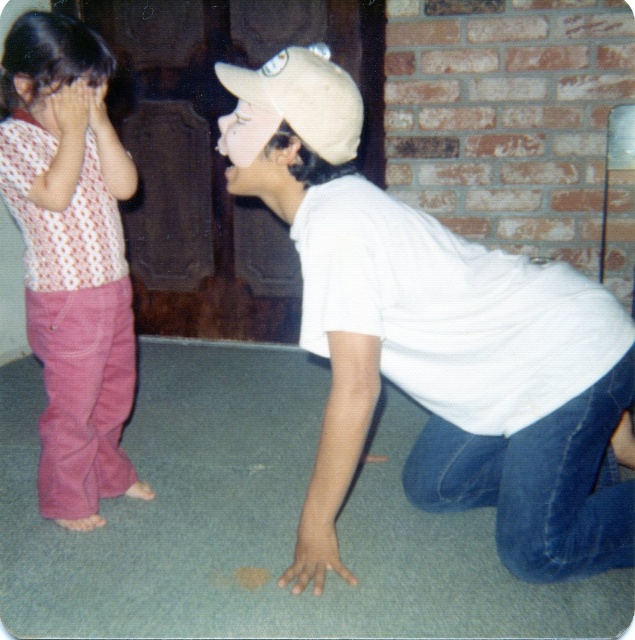
You are a tailor trying to decide which item to alter first. The dotted fabric shirt at left needs to be widened, and the beige fabric baseball cap at center requires narrowing. Based on their current dimensions, which item should you prioritize to ensure both fit properly?

The dotted fabric shirt at left is thinner than the beige fabric baseball cap at center, so you should prioritize altering the beige fabric baseball cap at center first since it needs narrowing and is currently wider than the shirt.

You are standing in the room and want to find the white matte shirt at center. According to the coordinates provided, where should you look to locate it?

The white matte shirt at center is located at point 0.533 on the x axis and 0.687 on the y axis.

You are a fashion designer observing two children in an indoor setting. You notice the dotted fabric shirt at left and the beige fabric baseball cap at center. Which clothing item is higher in position?

The dotted fabric shirt at left is taller than the beige fabric baseball cap at center.